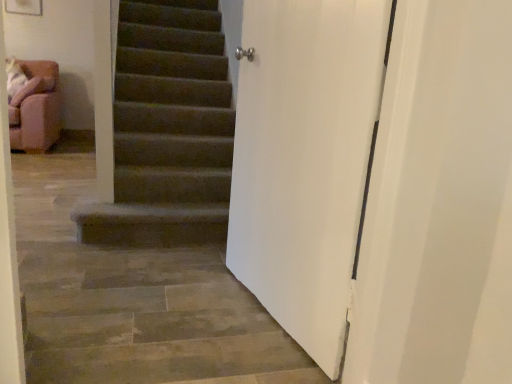
Describe the element at coordinates (305, 158) in the screenshot. I see `white matte door at center` at that location.

From the picture: What is the approximate height of white matte door at center?

The height of white matte door at center is 4.25 feet.

You are a GUI agent. You are given a task and a screenshot of the screen. Output one action in this format:
    pyautogui.click(x=<x>, y=<y>)
    Task: Click on the white matte door at center
    The height and width of the screenshot is (384, 512).
    Given the screenshot: What is the action you would take?
    305,158

At what (x,y) coordinates should I click in order to perform the action: click on white matte door at center. Please return your answer as a coordinate pair (x, y). Looking at the image, I should click on (305, 158).